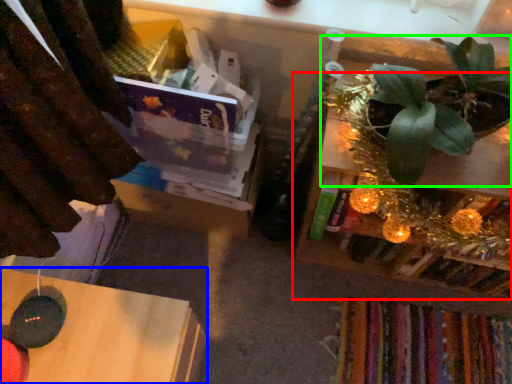
Question: Considering the real-world distances, which object is farthest from shelf (highlighted by a red box)? table (highlighted by a blue box) or houseplant (highlighted by a green box)?

Choices:
 (A) table
 (B) houseplant

Answer: (A)